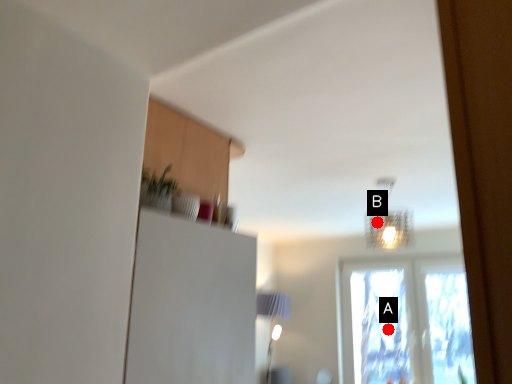
Question: Two points are circled on the image, labeled by A and B beside each circle. Which of the following is the closest to the observer?

Choices:
 (A) A is closer
 (B) B is closer

Answer: (B)